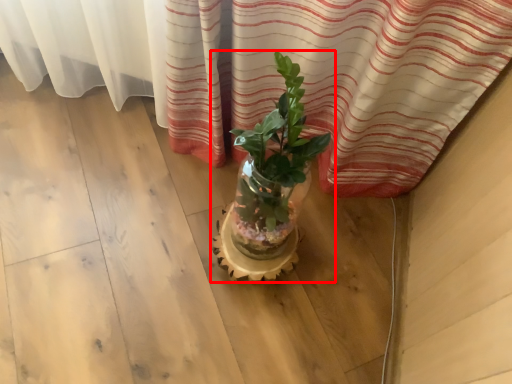
Question: From the image's perspective, where is houseplant (annotated by the red box) located relative to flowerpot?

Choices:
 (A) below
 (B) above

Answer: (B)